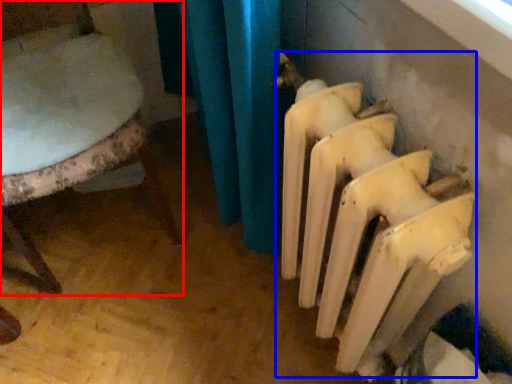
Question: Which of the following is the farthest to the observer, chair (highlighted by a red box) or radiator (highlighted by a blue box)?

Choices:
 (A) chair
 (B) radiator

Answer: (A)